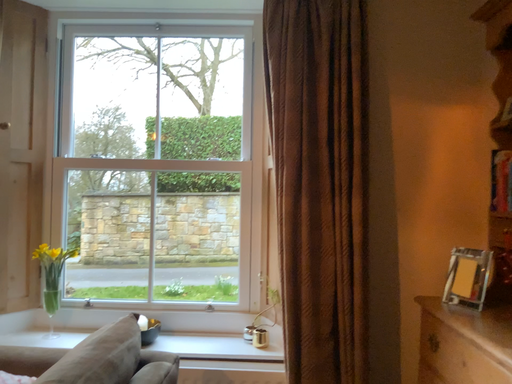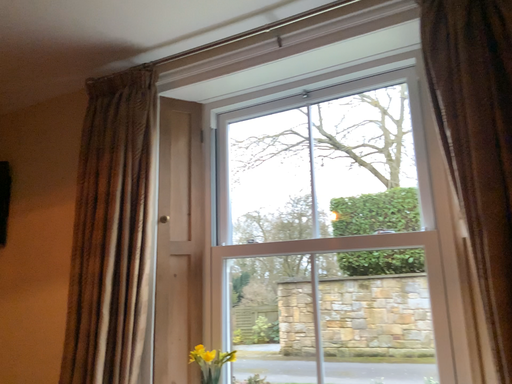
Question: Which way did the camera rotate in the video?

Choices:
 (A) rotated right
 (B) rotated left

Answer: (B)